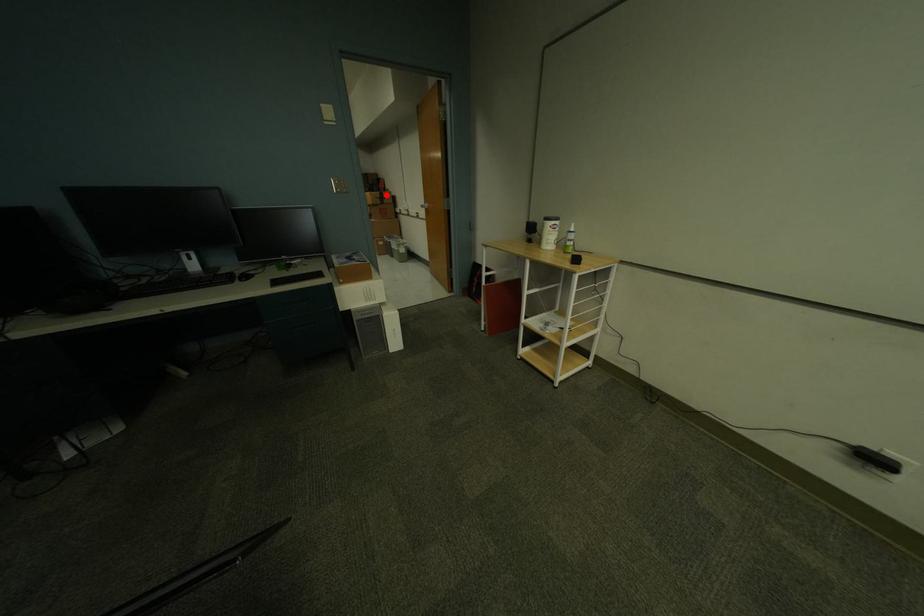
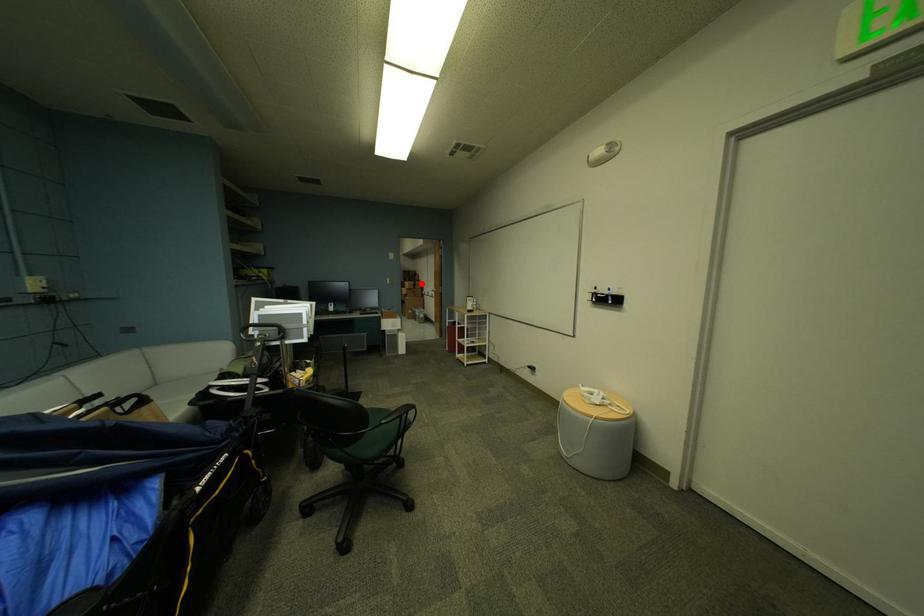
I am providing you with two images of the same scene from different viewpoints. A red point is marked on the first image and another point is marked on the second image. Does the point marked in image1 correspond to the same location as the one in image2?

Yes